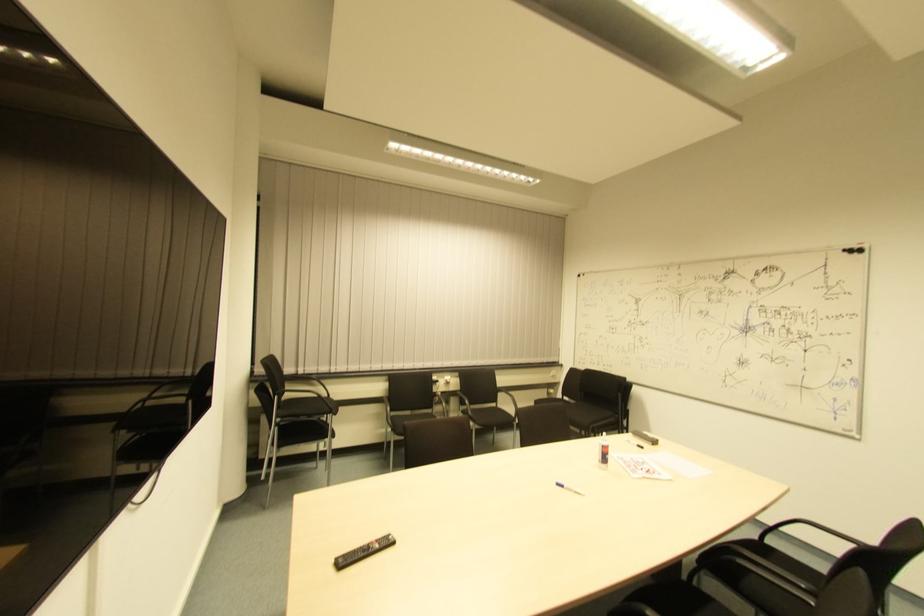
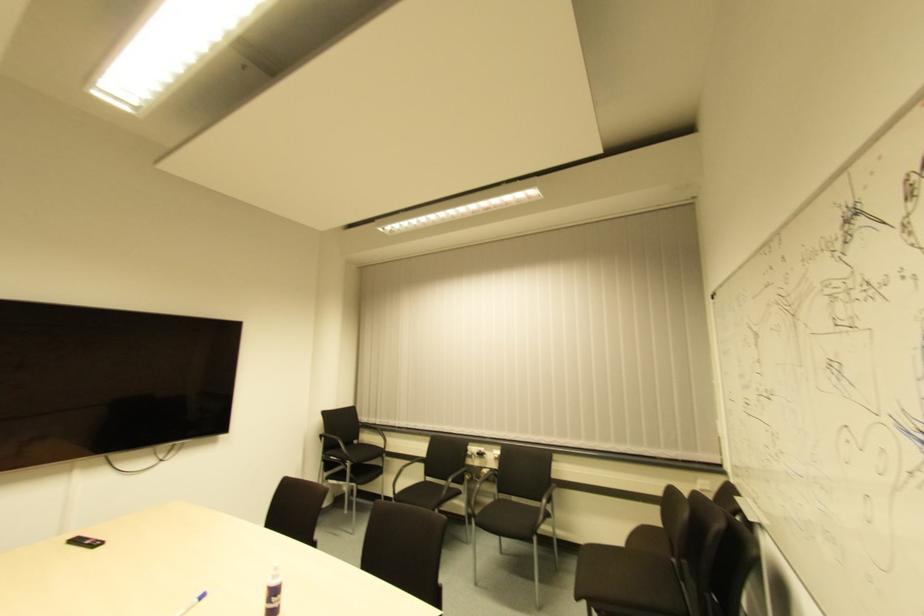
Find the pixel in the second image that matches pixel 445 386 in the first image.

(494, 462)